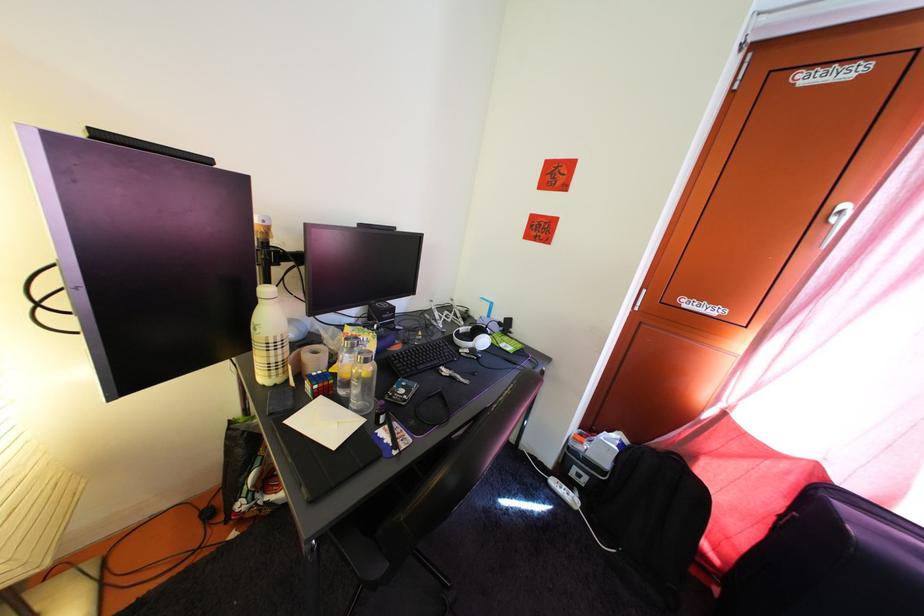
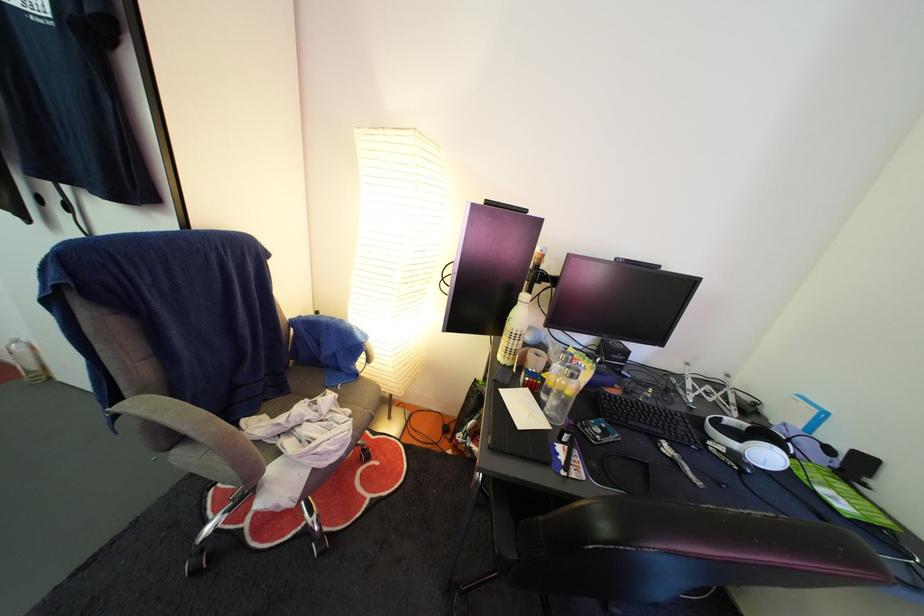
Find the pixel in the second image that matches the point at 273,387 in the first image.

(509, 365)